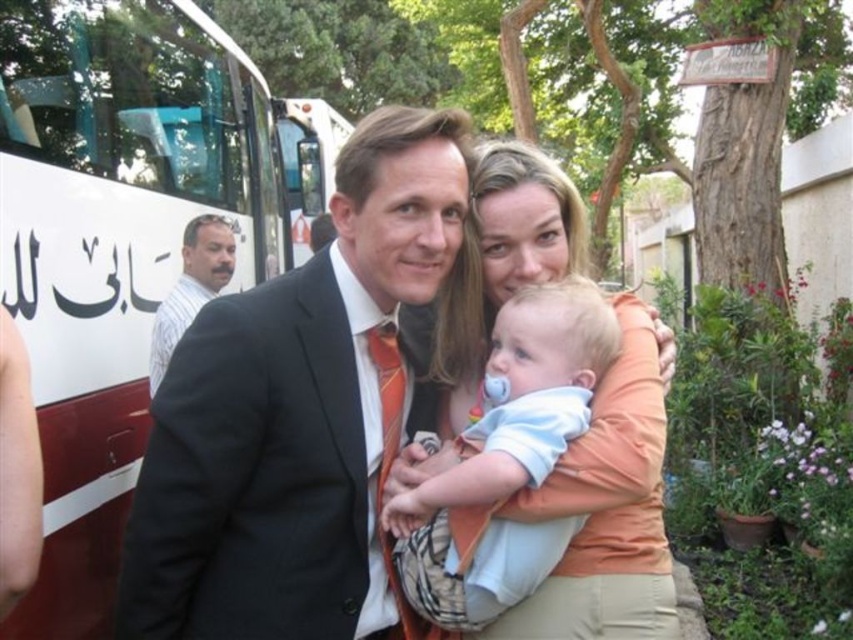
Question: Which is nearer to the white matte bus at left?

Choices:
 (A) white glossy bus at upper left
 (B) black suit at center
 (C) light blue fabric baby at center

Answer: (A)

Question: Among these objects, which one is nearest to the camera?

Choices:
 (A) striped shirt at left
 (B) light blue fabric baby at center
 (C) white glossy bus at upper left

Answer: (B)

Question: Is black suit at center smaller than light blue fabric baby at center?

Choices:
 (A) yes
 (B) no

Answer: (B)

Question: Is light blue fabric baby at center to the left of white glossy bus at upper left from the viewer's perspective?

Choices:
 (A) no
 (B) yes

Answer: (A)

Question: Is white matte bus at left bigger than striped shirt at left?

Choices:
 (A) no
 (B) yes

Answer: (B)

Question: Which of the following is the farthest from the observer?

Choices:
 (A) white glossy bus at upper left
 (B) striped shirt at left
 (C) white matte bus at left
 (D) light blue fabric baby at center

Answer: (A)